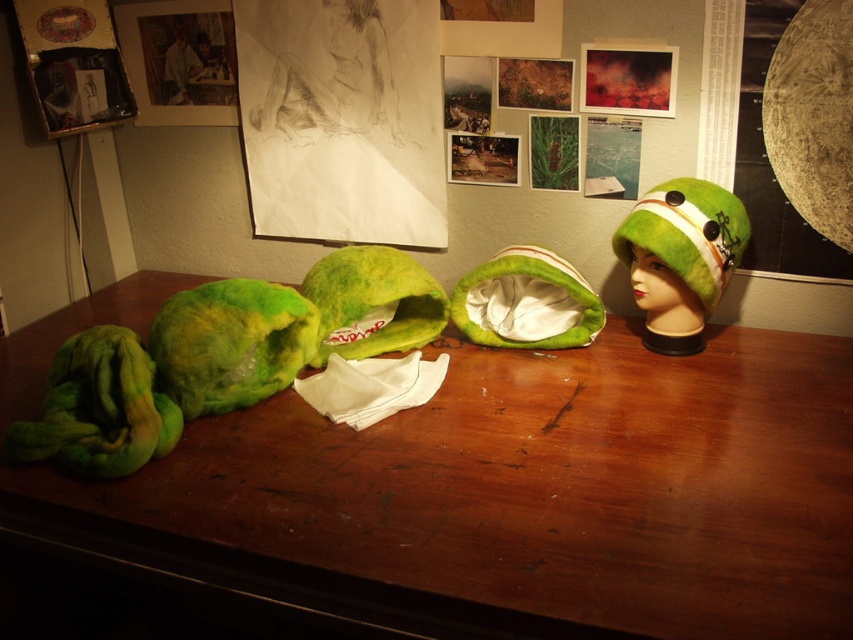
Does green felted hat at center appear on the left side of green felt hat at right?

Correct, you'll find green felted hat at center to the left of green felt hat at right.

Which is behind, point (428, 444) or point (689, 262)?

Positioned behind is point (689, 262).

Locate an element on the screen. This screenshot has width=853, height=640. green felted hat at center is located at coordinates (514, 497).